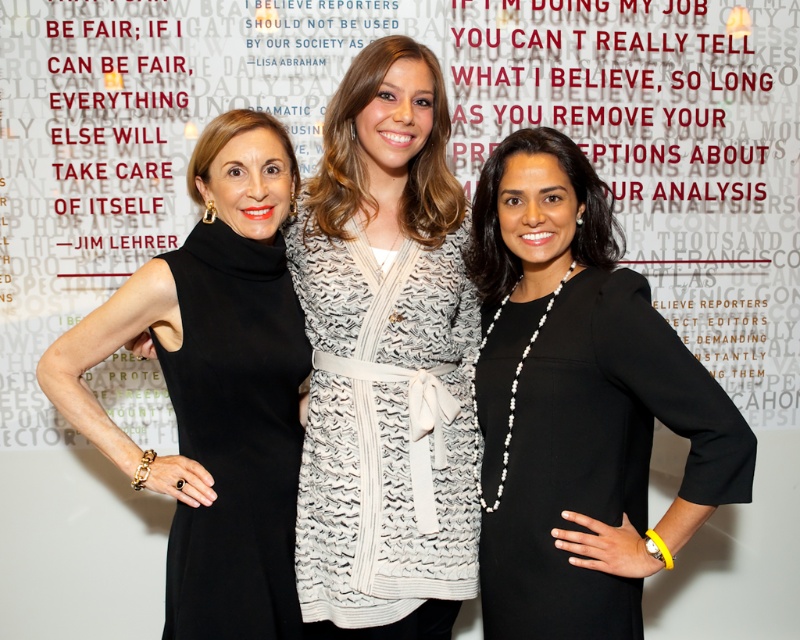
Question: Is black satin dress at center wider than black sleeveless dress at left?

Choices:
 (A) yes
 (B) no

Answer: (B)

Question: Which point appears closest to the camera in this image?

Choices:
 (A) click(424, 328)
 (B) click(170, 532)
 (C) click(266, 484)
 (D) click(598, 241)

Answer: (C)

Question: Is white textured sweater at center bigger than black matte dress at left?

Choices:
 (A) no
 (B) yes

Answer: (B)

Question: Among these objects, which one is nearest to the camera?

Choices:
 (A) white textured sweater at center
 (B) black sleeveless dress at left
 (C) black satin dress at center

Answer: (C)

Question: Observing the image, what is the correct spatial positioning of black satin dress at center in reference to black sleeveless dress at left?

Choices:
 (A) left
 (B) right

Answer: (B)

Question: Based on their relative distances, which object is farther from the black satin dress at center?

Choices:
 (A) white textured sweater at center
 (B) black matte dress at left

Answer: (B)